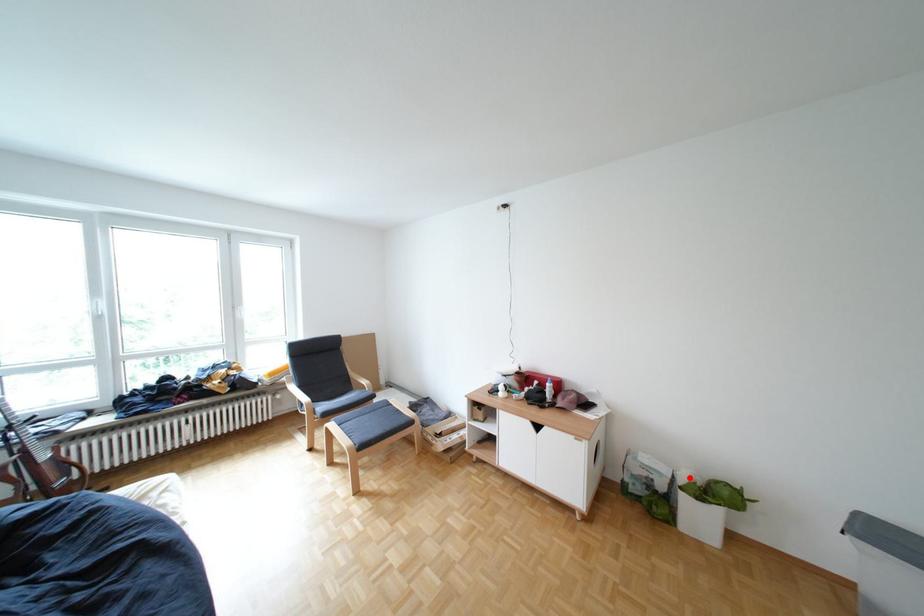
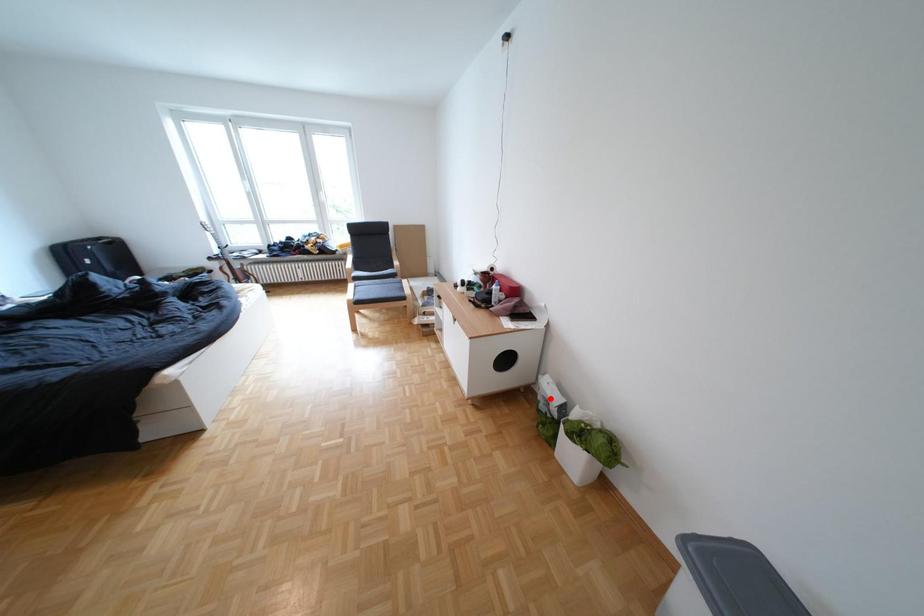
I am providing you with two images of the same scene from different viewpoints. A red point is marked on the first image and another point is marked on the second image. Do the highlighted points in image1 and image2 indicate the same real-world spot?

No